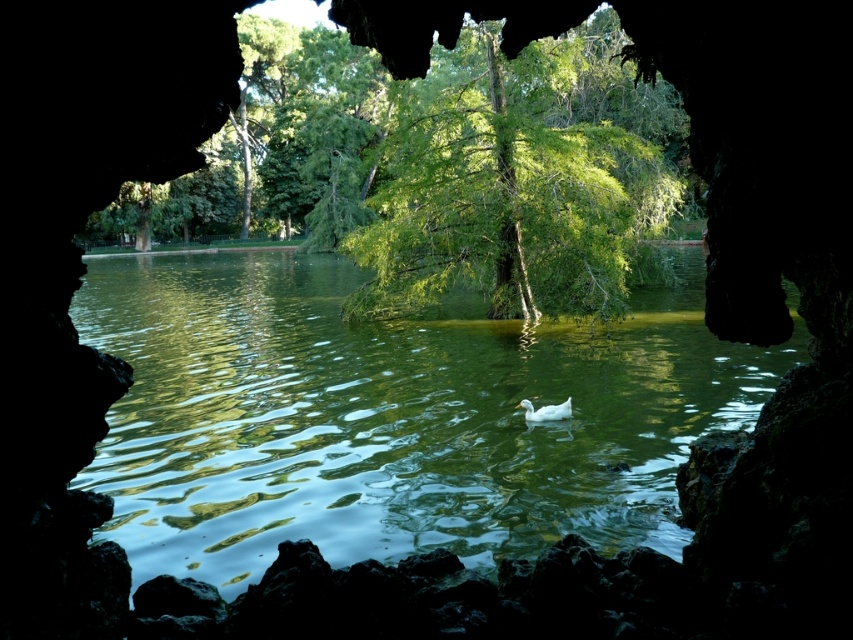
This screenshot has height=640, width=853. In order to click on green smooth water at center in this screenshot , I will do `click(392, 417)`.

Is point (265, 384) closer to viewer compared to point (601, 304)?

Yes, point (265, 384) is in front of point (601, 304).

Where is `green smooth water at center`? The image size is (853, 640). green smooth water at center is located at coordinates (392, 417).